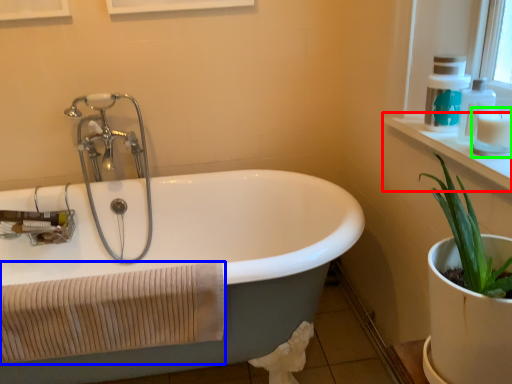
Question: Based on their relative distances, which object is farther from window sill (highlighted by a red box)? Choose from bath towel (highlighted by a blue box) and toiletry (highlighted by a green box).

Choices:
 (A) bath towel
 (B) toiletry

Answer: (A)